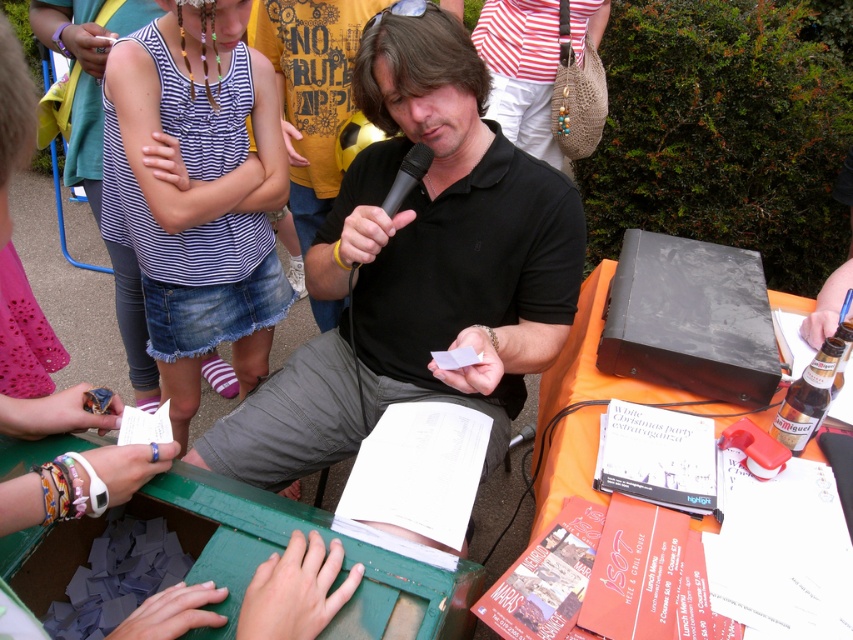
What are the coordinates of the black matte shirt at center?

The coordinates of the black matte shirt at center are at point (416, 268).

You are a photographer taking a picture of the scene. The black matte shirt at center and the black matte microphone at center are both in the frame. Which object will appear larger in the photo?

The black matte shirt at center is much taller than the black matte microphone at center, so it will appear larger in the photo.